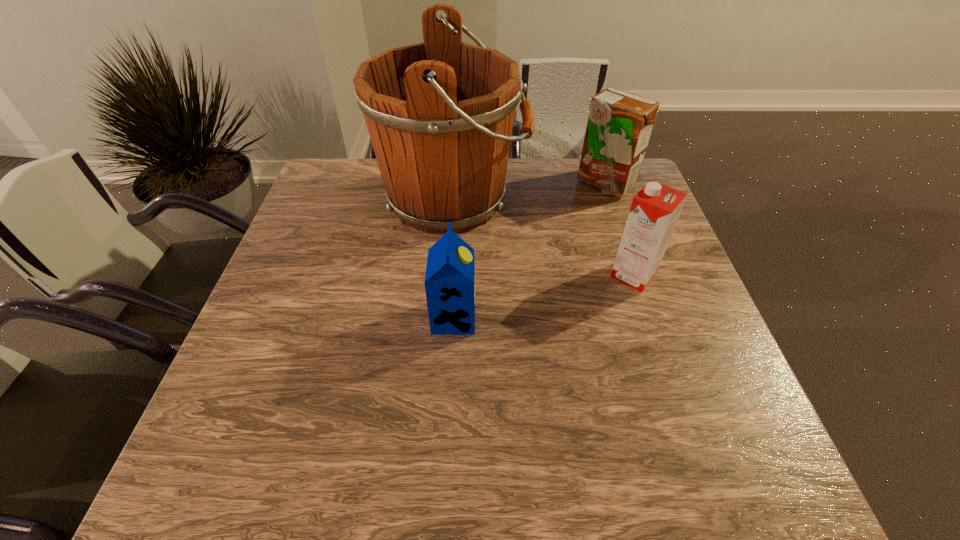
Find the location of `free space between the second nearest carton and the farthest carton`. free space between the second nearest carton and the farthest carton is located at coordinates (619, 230).

The image size is (960, 540). Find the location of `free area in between the second nearest carton and the leftmost carton`. free area in between the second nearest carton and the leftmost carton is located at coordinates (543, 296).

This screenshot has width=960, height=540. Identify the location of free spot between the third farthest object and the nearest carton. (543, 296).

This screenshot has width=960, height=540. Find the location of `vacant area that lies between the farthest carton and the bucket`. vacant area that lies between the farthest carton and the bucket is located at coordinates (529, 191).

Locate which object is the closest to the farthest carton. Please provide its 2D coordinates. Your answer should be formatted as a tuple, i.e. [(x, y)], where the tuple contains the x and y coordinates of a point satisfying the conditions above.

[(440, 114)]

Select which object is the closest to the farthest carton. Please provide its 2D coordinates. Your answer should be formatted as a tuple, i.e. [(x, y)], where the tuple contains the x and y coordinates of a point satisfying the conditions above.

[(440, 114)]

Locate which carton ranks second in proximity to the nearest object. Please provide its 2D coordinates. Your answer should be formatted as a tuple, i.e. [(x, y)], where the tuple contains the x and y coordinates of a point satisfying the conditions above.

[(619, 126)]

The width and height of the screenshot is (960, 540). Identify the location of carton that is the second closest to the third farthest object. (449, 282).

Identify the location of vacant area that satisfies the following two spatial constraints: 1. with the handle on the side of the second nearest carton; 2. on the right side of the tallest object. (447, 275).

You are a GUI agent. You are given a task and a screenshot of the screen. Output one action in this format:
    pyautogui.click(x=<x>, y=<y>)
    Task: Click on the free space that satisfies the following two spatial constraints: 1. with the handle on the side of the tallest object; 2. on the right side of the third farthest object
    The width and height of the screenshot is (960, 540).
    Given the screenshot: What is the action you would take?
    pyautogui.click(x=447, y=275)